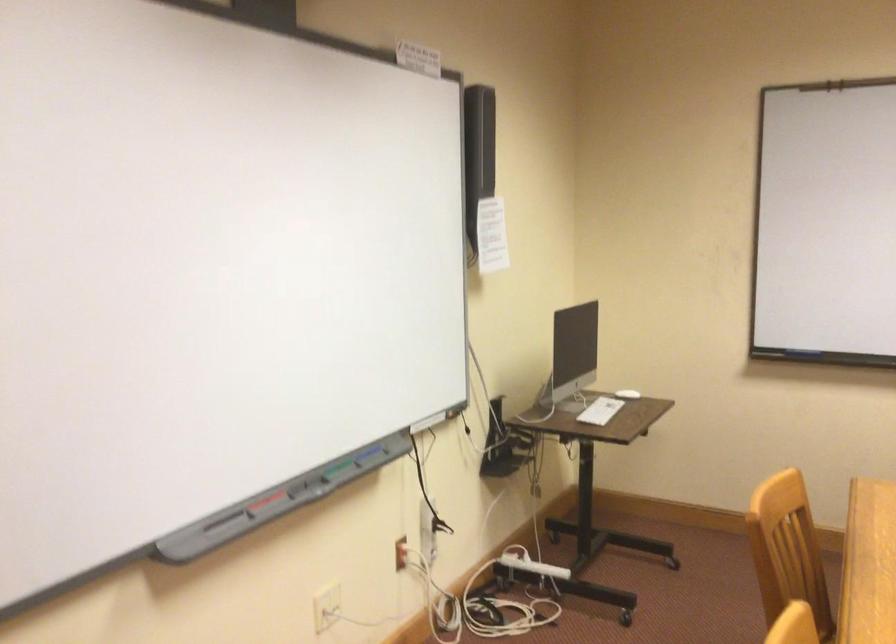
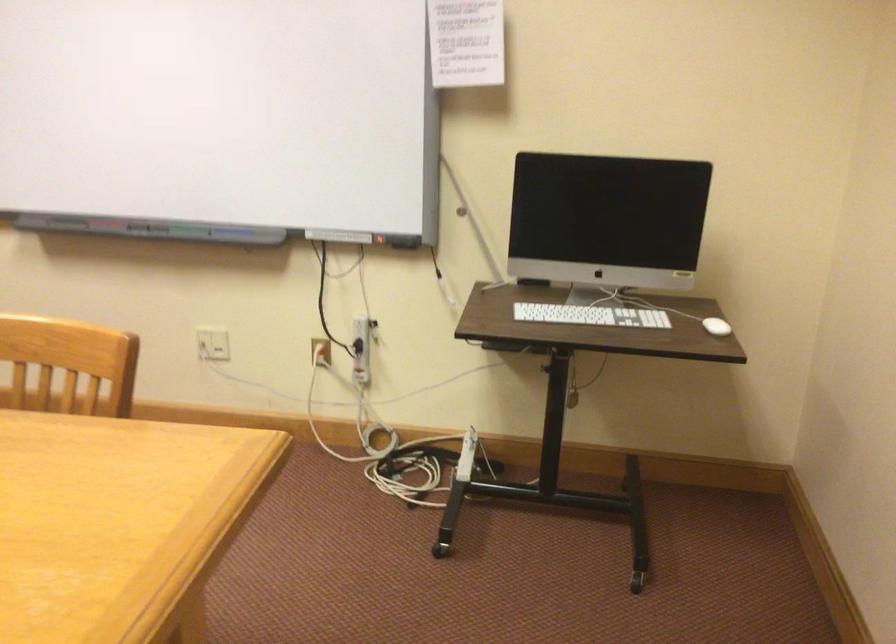
In the second image, find the point that corresponds to the point at 397,552 in the first image.

(321, 351)